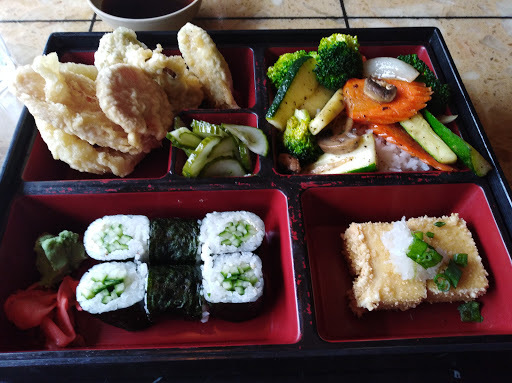
The height and width of the screenshot is (383, 512). I want to click on bottom half of bowl, so click(x=141, y=19).